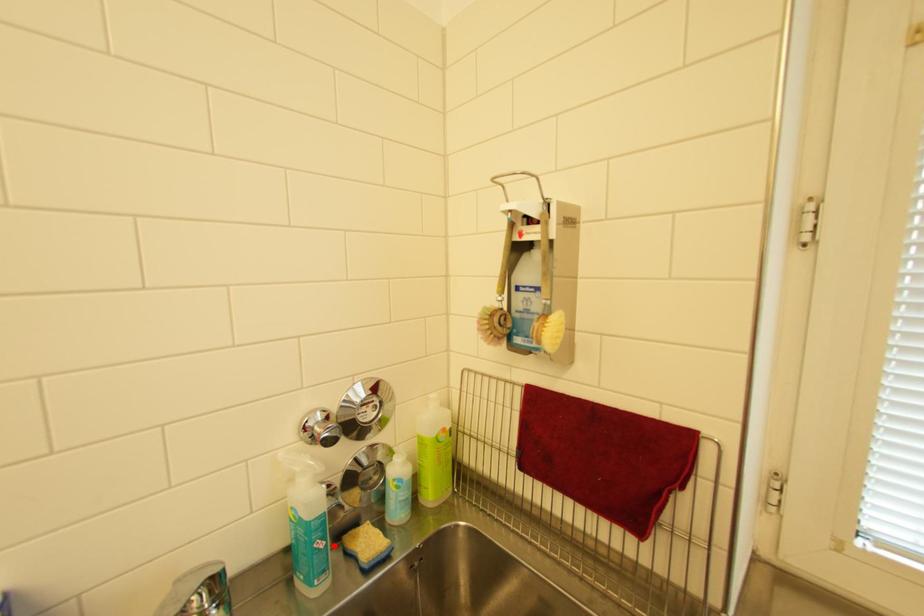
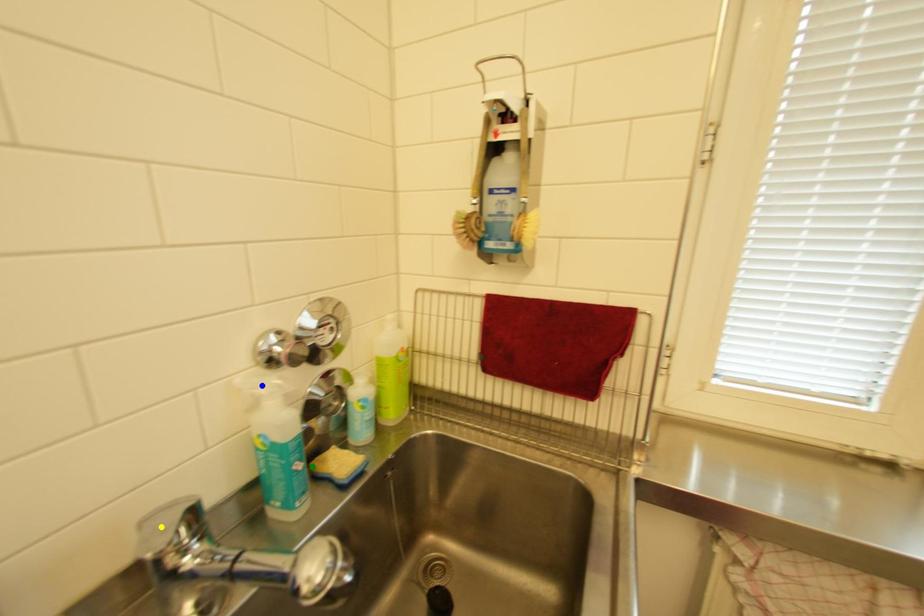
Question: I am providing you with two images of the same scene from different viewpoints. A red point is marked on the first image. You are given multiple points on the second image. Which point in image 2 represents the same 3d spot as the red point in image 1?

Choices:
 (A) blue point
 (B) yellow point
 (C) green point

Answer: (C)